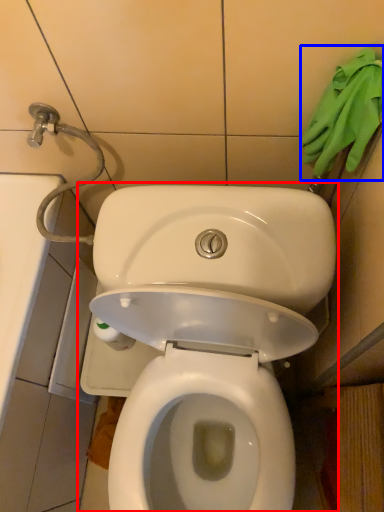
Question: Which of the following is the closest to the observer, toilet (highlighted by a red box) or material (highlighted by a blue box)?

Choices:
 (A) toilet
 (B) material

Answer: (A)